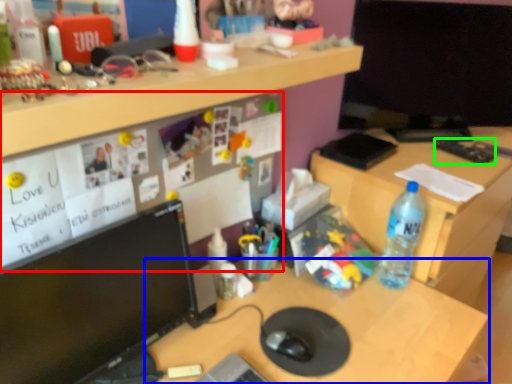
Question: Estimate the real-world distances between objects in this image. Which object is closer to bulletin board (highlighted by a red box), desk (highlighted by a blue box) or stationery (highlighted by a green box)?

Choices:
 (A) desk
 (B) stationery

Answer: (A)